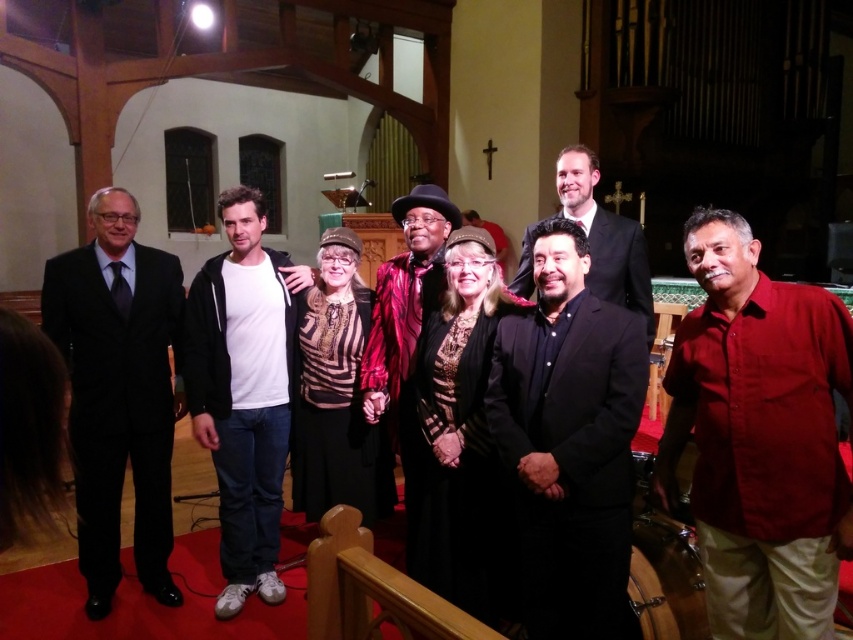
You are standing in the church and want to take a photo of two specific points marked as point 1 at (766, 637) and point 2 at (231, 545). Which point is closer to your camera lens?

Point 1 at (766, 637) is closer to the camera lens than point 2 at (231, 545).

Consider the image. You are a photographer adjusting the camera settings to ensure all subjects are in focus. The white cotton hoodie at center and the shiny red jacket at center are both in the center area. Which one is taller?

The white cotton hoodie at center has a greater height compared to the shiny red jacket at center, so the white cotton hoodie at center is taller.

You are a photographer trying to adjust the lighting for a group photo in a church. You notice the matte red shirt at right and the white cotton hoodie at center. Which clothing item is covering part of the other?

The matte red shirt at right is positioned over the white cotton hoodie at center, so it is covering part of the white cotton hoodie at center.